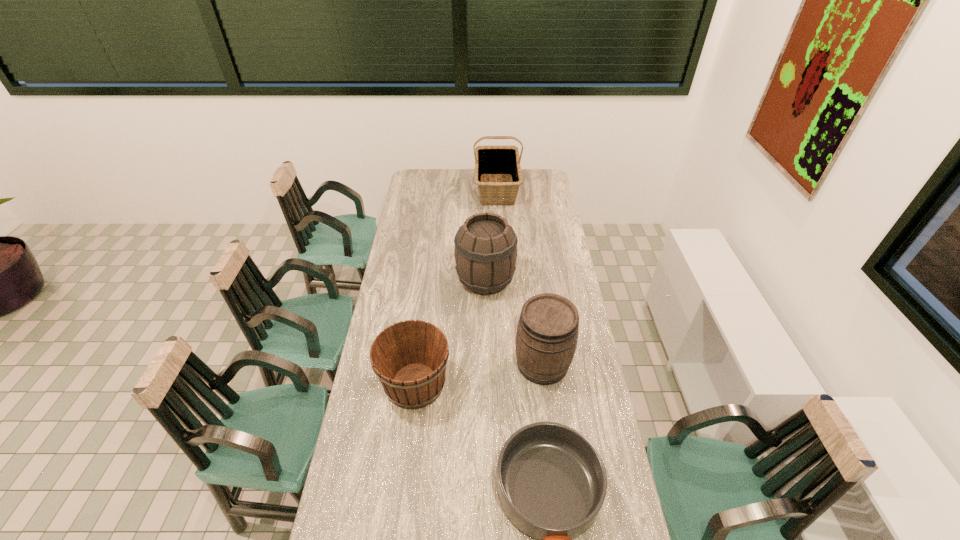
Locate an element on the screen. Image resolution: width=960 pixels, height=540 pixels. basket is located at coordinates (493, 163).

Identify the location of the farthest wine bucket. (485, 252).

Where is `the second shortest object`? The height and width of the screenshot is (540, 960). the second shortest object is located at coordinates (409, 358).

Where is `vacant space located by the handle of the basket`? This screenshot has width=960, height=540. vacant space located by the handle of the basket is located at coordinates (500, 246).

At what (x,y) coordinates should I click in order to perform the action: click on free region located 0.130m on the front of the second farthest object. Please return your answer as a coordinate pair (x, y). This screenshot has width=960, height=540. Looking at the image, I should click on (486, 326).

Locate an element on the screen. free location located on the back of the second shortest object is located at coordinates (428, 284).

Identify the location of object located at the far edge. (493, 163).

Locate an element on the screen. Image resolution: width=960 pixels, height=540 pixels. object present at the left edge is located at coordinates (409, 358).

Where is `object that is at the right edge`? object that is at the right edge is located at coordinates (547, 332).

Find the location of a particular element. Image resolution: width=960 pixels, height=540 pixels. free region at the left edge is located at coordinates [x=369, y=355].